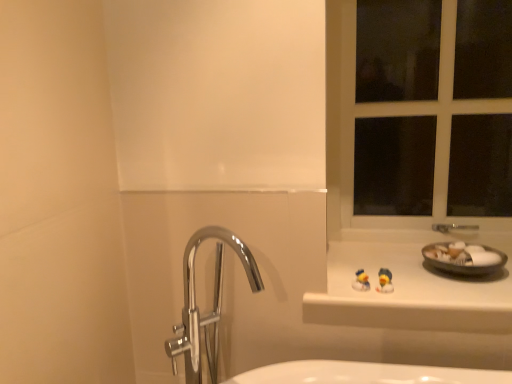
Where is `vacant point to the left of yellow rubber duck at center, which appears as the second miniature when viewed from the left`? vacant point to the left of yellow rubber duck at center, which appears as the second miniature when viewed from the left is located at coordinates (345, 292).